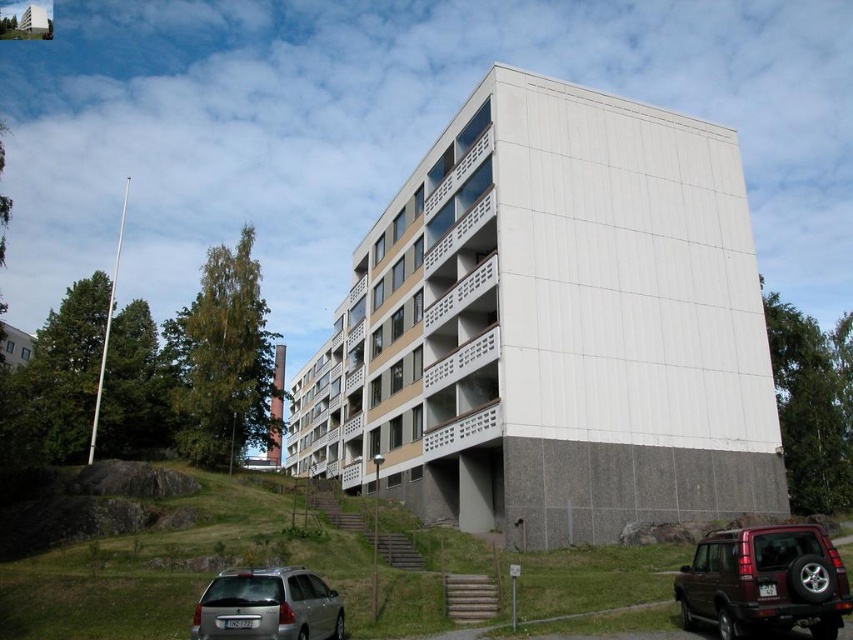
Question: Observing the image, what is the correct spatial positioning of green grass at lower center in reference to shiny maroon suv at lower right?

Choices:
 (A) right
 (B) left

Answer: (B)

Question: Is green grass at lower center wider than shiny maroon suv at lower right?

Choices:
 (A) no
 (B) yes

Answer: (B)

Question: Does green grass at lower center have a larger size compared to shiny maroon suv at lower right?

Choices:
 (A) yes
 (B) no

Answer: (A)

Question: Estimate the real-world distances between objects in this image. Which object is closer to the green grass at lower center?

Choices:
 (A) shiny maroon suv at lower right
 (B) silver metallic station wagon at lower left

Answer: (B)

Question: Which object is positioned farthest from the silver metallic station wagon at lower left?

Choices:
 (A) shiny maroon suv at lower right
 (B) green grass at lower center

Answer: (A)

Question: Which point is farther to the camera?

Choices:
 (A) (317, 554)
 (B) (212, 616)
 (C) (804, 534)

Answer: (A)